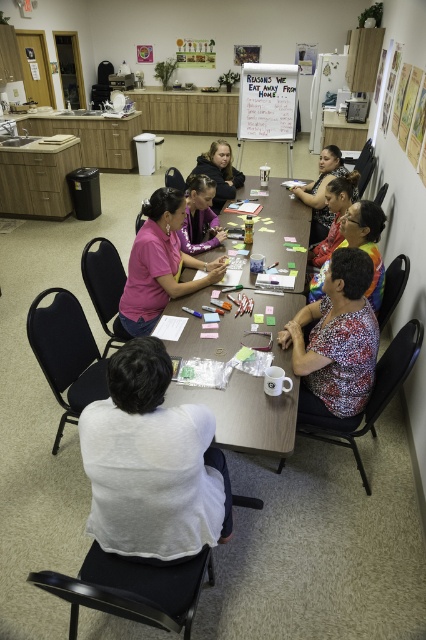
Question: Which point is closer to the camera taking this photo?

Choices:
 (A) (244, 273)
 (B) (227, 179)

Answer: (A)

Question: Is printed fabric blouse at center further to the viewer compared to matte black hair at center?

Choices:
 (A) no
 (B) yes

Answer: (A)

Question: Observing the image, what is the correct spatial positioning of printed fabric blouse at center in reference to matte floral blouse at center?

Choices:
 (A) above
 (B) below

Answer: (B)

Question: Is matte pink shirt at center thinner than white paperboard at upper center?

Choices:
 (A) no
 (B) yes

Answer: (B)

Question: Which point is closer to the camera?

Choices:
 (A) (212, 236)
 (B) (311, 336)
 (C) (247, 420)

Answer: (C)

Question: Estimate the real-world distances between objects in this image. Which object is closer to the wooden table at center?

Choices:
 (A) matte black hair at center
 (B) matte floral blouse at center
 (C) printed fabric blouse at center

Answer: (C)